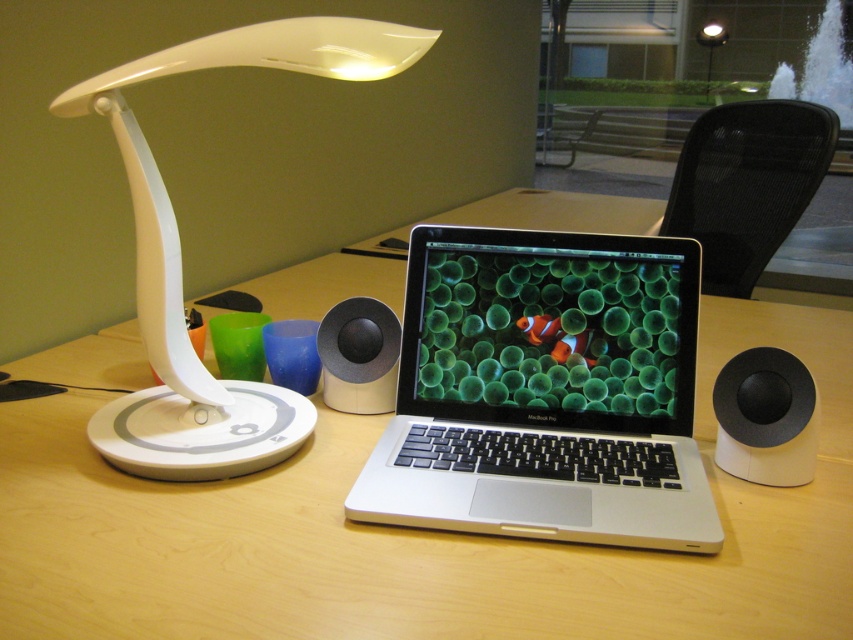
Question: Which of the following is the farthest from the observer?

Choices:
 (A) (767, 387)
 (B) (3, 554)

Answer: (A)

Question: Observing the image, what is the correct spatial positioning of black mesh chair at upper right in reference to white matte speaker at right?

Choices:
 (A) left
 (B) right

Answer: (B)

Question: Considering the real-world distances, which object is farthest from the wooden table at center?

Choices:
 (A) silver/black laptop at center
 (B) black matte speaker at center
 (C) white matte speaker at right
 (D) black mesh chair at upper right

Answer: (D)

Question: Considering the real-world distances, which object is closest to the silver/black laptop at center?

Choices:
 (A) orange matte clown fish at center
 (B) white glossy table lamp at left
 (C) black matte speaker at center
 (D) wooden table at center

Answer: (A)

Question: Where is orange matte clown fish at center located in relation to white plastic table lamp at upper center in the image?

Choices:
 (A) right
 (B) left

Answer: (B)

Question: Can you confirm if white glossy table lamp at left is bigger than black mesh chair at upper right?

Choices:
 (A) yes
 (B) no

Answer: (B)